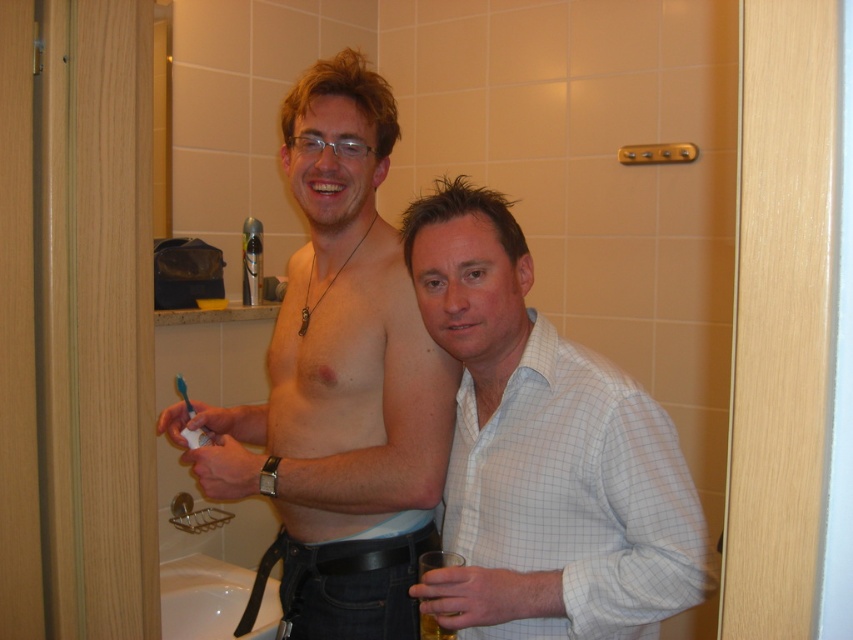
Question: Which of the following is the closest to the observer?

Choices:
 (A) (265, 624)
 (B) (183, 381)
 (C) (271, 493)
 (D) (538, 380)

Answer: (D)

Question: Can you confirm if white checkered shirt at center is thinner than white glossy sink at lower left?

Choices:
 (A) no
 (B) yes

Answer: (B)

Question: Which object is positioned farthest from the blue plastic toothbrush at lower left?

Choices:
 (A) white checkered shirt at center
 (B) smooth skin torso at center
 (C) white glossy sink at lower left

Answer: (C)

Question: Which object appears closest to the camera in this image?

Choices:
 (A) white glossy sink at lower left
 (B) white checkered shirt at center
 (C) blue plastic toothbrush at lower left
 (D) smooth skin torso at center

Answer: (B)

Question: Is smooth skin torso at center below white glossy sink at lower left?

Choices:
 (A) no
 (B) yes

Answer: (A)

Question: Is smooth skin torso at center wider than blue plastic toothbrush at lower left?

Choices:
 (A) no
 (B) yes

Answer: (B)